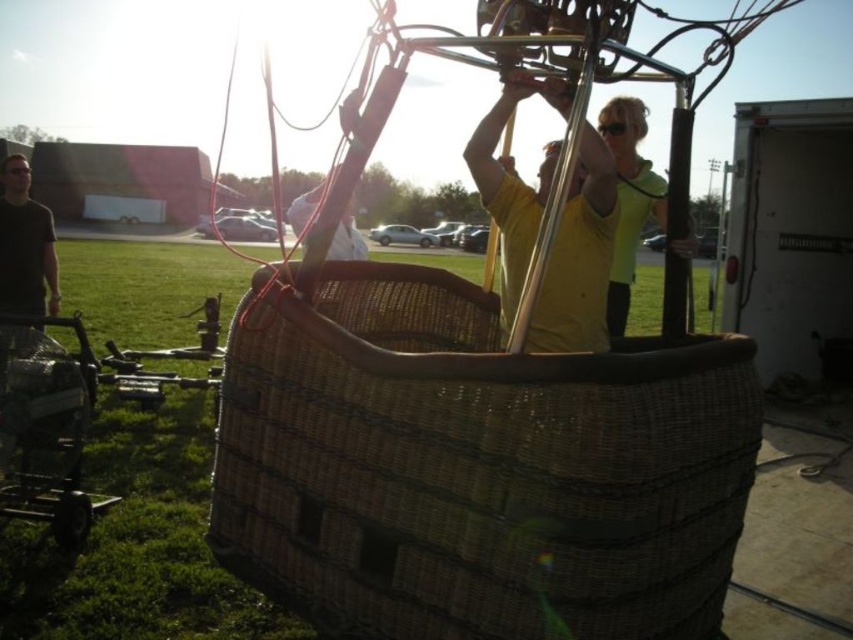
You are standing at the position marked by point [578,259] in the image. What object is directly in front of you?

The yellow matte shirt at center is directly in front of you at point [578,259].